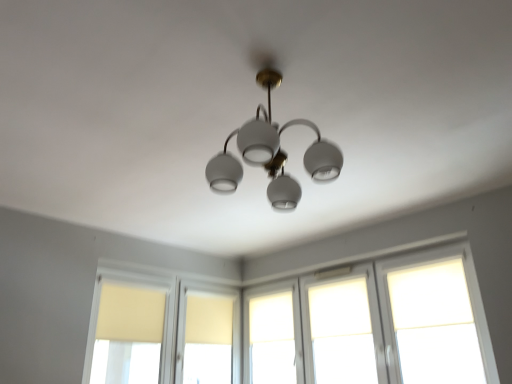
Question: Considering the relative sizes of white matte window at center, which is counted as the 3th window, starting from the left, and matte yellow curtain at left, the sixth window in the right-to-left sequence, in the image provided, is white matte window at center, which is counted as the 3th window, starting from the left, thinner than matte yellow curtain at left, the sixth window in the right-to-left sequence,?

Choices:
 (A) yes
 (B) no

Answer: (A)

Question: From the image's perspective, would you say white matte window at center, the fourth window positioned from the right, is shown under matte yellow curtain at left, the sixth window in the right-to-left sequence?

Choices:
 (A) yes
 (B) no

Answer: (A)

Question: From a real-world perspective, does white matte window at center, the fourth window positioned from the right, stand above matte yellow curtain at left, the first window from the left?

Choices:
 (A) yes
 (B) no

Answer: (A)

Question: Is white matte window at center, the fourth window positioned from the right, to the right of matte yellow curtain at left, the sixth window in the right-to-left sequence, from the viewer's perspective?

Choices:
 (A) yes
 (B) no

Answer: (A)

Question: Can we say white matte window at center, the fourth window positioned from the right, lies outside matte yellow curtain at left, the first window from the left?

Choices:
 (A) no
 (B) yes

Answer: (B)

Question: From a real-world perspective, is white matte window at center, which is counted as the 3th window, starting from the left, beneath matte yellow curtain at left, the sixth window in the right-to-left sequence?

Choices:
 (A) no
 (B) yes

Answer: (A)

Question: Does white matte window at center, which is counted as the 3th window, starting from the left, have a greater width compared to matte yellow window at center, placed as the second window when sorted from left to right?

Choices:
 (A) yes
 (B) no

Answer: (A)

Question: From the image's perspective, is white matte window at center, which is counted as the 3th window, starting from the left, on top of matte yellow window at center, placed as the 5th window when sorted from right to left?

Choices:
 (A) no
 (B) yes

Answer: (B)

Question: Is white matte window at center, the fourth window positioned from the right, oriented away from matte yellow window at center, placed as the second window when sorted from left to right?

Choices:
 (A) no
 (B) yes

Answer: (A)

Question: Does white matte window at center, which is counted as the 3th window, starting from the left, have a greater height compared to matte yellow window at center, placed as the 5th window when sorted from right to left?

Choices:
 (A) yes
 (B) no

Answer: (A)

Question: Can you confirm if white matte window at center, the fourth window positioned from the right, is thinner than matte yellow window at center, placed as the second window when sorted from left to right?

Choices:
 (A) yes
 (B) no

Answer: (B)

Question: Would you say matte yellow window at center, placed as the second window when sorted from left to right, is part of white matte window at center, the fourth window positioned from the right,'s contents?

Choices:
 (A) no
 (B) yes

Answer: (A)

Question: Is matte yellow window at center, placed as the 5th window when sorted from right to left, behind matte yellow curtain at left, the first window from the left?

Choices:
 (A) no
 (B) yes

Answer: (B)